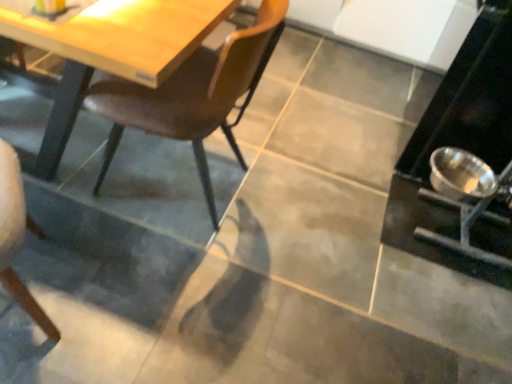
Identify the location of silver metallic bowl at lower right. Image resolution: width=512 pixels, height=384 pixels. (464, 155).

Measure the distance between point [433,235] and camera.

Point [433,235] and camera are 1.80 meters apart from each other.

Describe the element at coordinates (464, 155) in the screenshot. I see `silver metallic bowl at lower right` at that location.

In order to face silver metallic bowl at lower right, should I rotate leftwards or rightwards?

Rotate right and turn 29.774 degrees.

What do you see at coordinates (193, 94) in the screenshot? I see `brown leather chair at center` at bounding box center [193, 94].

What is the approximate height of brown leather chair at center?

brown leather chair at center is 31.47 inches in height.

Locate an element on the screen. brown leather chair at center is located at coordinates (193, 94).

The height and width of the screenshot is (384, 512). I want to click on silver metallic bowl at lower right, so click(464, 155).

Does silver metallic bowl at lower right appear on the right side of brown leather chair at center?

Correct, you'll find silver metallic bowl at lower right to the right of brown leather chair at center.

Between silver metallic bowl at lower right and brown leather chair at center, which one is positioned in front?

Positioned in front is brown leather chair at center.

Is point (471, 94) positioned behind point (257, 49)?

Yes, point (471, 94) is behind point (257, 49).

From the image's perspective, is silver metallic bowl at lower right located above brown leather chair at center?

Yes, from the image's perspective, silver metallic bowl at lower right is above brown leather chair at center.

Consider the image. From a real-world perspective, which is physically below, silver metallic bowl at lower right or brown leather chair at center?

In real-world perspective, brown leather chair at center is lower.

Which of these two, silver metallic bowl at lower right or brown leather chair at center, is wider?

silver metallic bowl at lower right is wider.

Who is taller, silver metallic bowl at lower right or brown leather chair at center?

Standing taller between the two is silver metallic bowl at lower right.

Does silver metallic bowl at lower right have a larger size compared to brown leather chair at center?

Correct, silver metallic bowl at lower right is larger in size than brown leather chair at center.

Choose the correct answer: Is silver metallic bowl at lower right inside brown leather chair at center or outside it?

silver metallic bowl at lower right exists outside the volume of brown leather chair at center.

Is there a large distance between silver metallic bowl at lower right and brown leather chair at center?

Actually, silver metallic bowl at lower right and brown leather chair at center are a little close together.

Is silver metallic bowl at lower right facing towards brown leather chair at center?

No, silver metallic bowl at lower right is not turned towards brown leather chair at center.

What's the angular difference between silver metallic bowl at lower right and brown leather chair at center's facing directions?

The angle between the facing direction of silver metallic bowl at lower right and the facing direction of brown leather chair at center is 4.78 degrees.

Where is `chair below the silver metallic bowl at lower right (from a real-world perspective)`? chair below the silver metallic bowl at lower right (from a real-world perspective) is located at coordinates (193, 94).

Which is more to the left, brown leather chair at center or silver metallic bowl at lower right?

From the viewer's perspective, brown leather chair at center appears more on the left side.

Considering the relative positions of brown leather chair at center and silver metallic bowl at lower right in the image provided, is brown leather chair at center behind silver metallic bowl at lower right?

No, it is in front of silver metallic bowl at lower right.

Is point (137, 113) closer to viewer compared to point (461, 118)?

Yes, point (137, 113) is in front of point (461, 118).

From the image's perspective, would you say brown leather chair at center is positioned over silver metallic bowl at lower right?

No, from the image's perspective, brown leather chair at center is not over silver metallic bowl at lower right.

From a real-world perspective, is brown leather chair at center physically above silver metallic bowl at lower right?

Actually, brown leather chair at center is physically below silver metallic bowl at lower right in the real world.

Can you confirm if brown leather chair at center is wider than silver metallic bowl at lower right?

Incorrect, the width of brown leather chair at center does not surpass that of silver metallic bowl at lower right.

Considering the relative sizes of brown leather chair at center and silver metallic bowl at lower right in the image provided, is brown leather chair at center shorter than silver metallic bowl at lower right?

Indeed, brown leather chair at center has a lesser height compared to silver metallic bowl at lower right.

Between brown leather chair at center and silver metallic bowl at lower right, which one has larger size?

With larger size is silver metallic bowl at lower right.

Would you say brown leather chair at center contains silver metallic bowl at lower right?

No, silver metallic bowl at lower right is located outside of brown leather chair at center.

Is brown leather chair at center next to silver metallic bowl at lower right?

No.

Does brown leather chair at center turn towards silver metallic bowl at lower right?

No, brown leather chair at center does not turn towards silver metallic bowl at lower right.

Where is `chair directly beneath the silver metallic bowl at lower right (from a real-world perspective)`? chair directly beneath the silver metallic bowl at lower right (from a real-world perspective) is located at coordinates (193, 94).

Where is `appliance behind the brown leather chair at center`? This screenshot has width=512, height=384. appliance behind the brown leather chair at center is located at coordinates (464, 155).

Identify the location of appliance on the right of the brown leather chair at center. The image size is (512, 384). (464, 155).